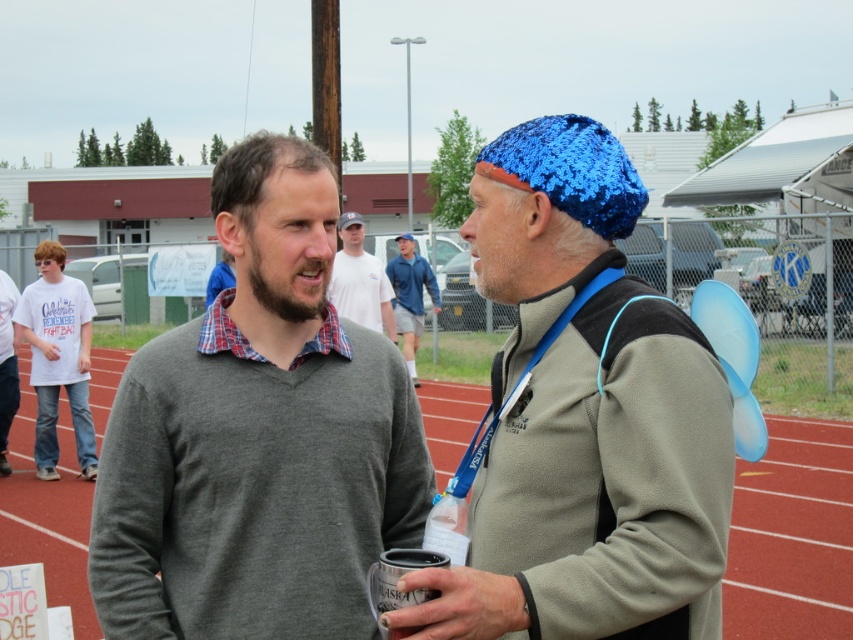
Question: Estimate the real-world distances between objects in this image. Which object is farther from the white cotton shirt at center?

Choices:
 (A) blue sequined beanie at center
 (B) white cotton shirt at left

Answer: (A)

Question: Is red rubber track at center to the right of white cotton shirt at center from the viewer's perspective?

Choices:
 (A) yes
 (B) no

Answer: (A)

Question: Is matte gray sweater at center bigger than translucent plastic cup at center?

Choices:
 (A) yes
 (B) no

Answer: (A)

Question: In this image, where is blue knitted hat at center located relative to white cotton shirt at left?

Choices:
 (A) below
 (B) above

Answer: (B)

Question: Estimate the real-world distances between objects in this image. Which object is closer to the matte gray sweater at center?

Choices:
 (A) red rubber track at center
 (B) white cotton shirt at center
 (C) translucent plastic cup at center
 (D) blue sequined beanie at center

Answer: (D)

Question: Which point is farther to the camera?

Choices:
 (A) (405, 356)
 (B) (343, 280)

Answer: (A)